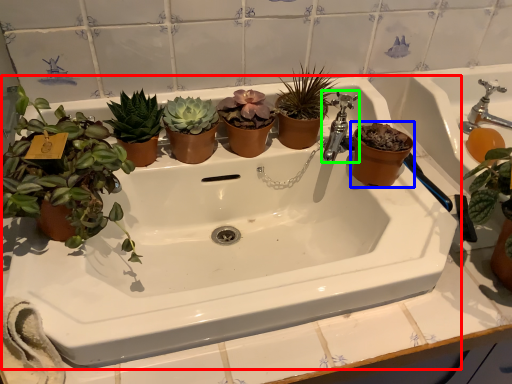
Question: Estimate the real-world distances between objects in this image. Which object is farther from sink (highlighted by a red box), flowerpot (highlighted by a blue box) or tap (highlighted by a green box)?

Choices:
 (A) flowerpot
 (B) tap

Answer: (B)